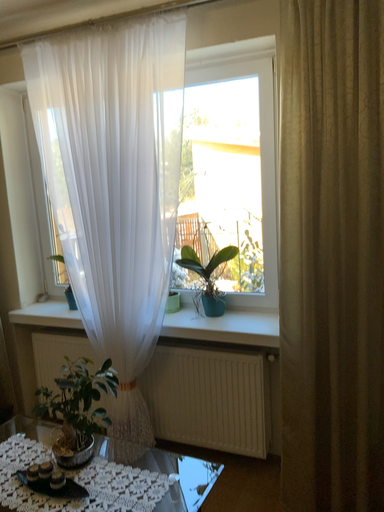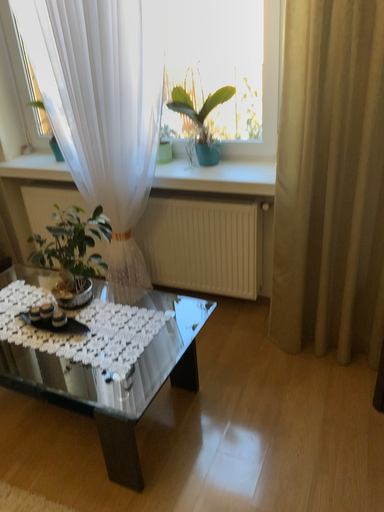
Question: Which way did the camera rotate in the video?

Choices:
 (A) rotated downward
 (B) rotated upward

Answer: (A)